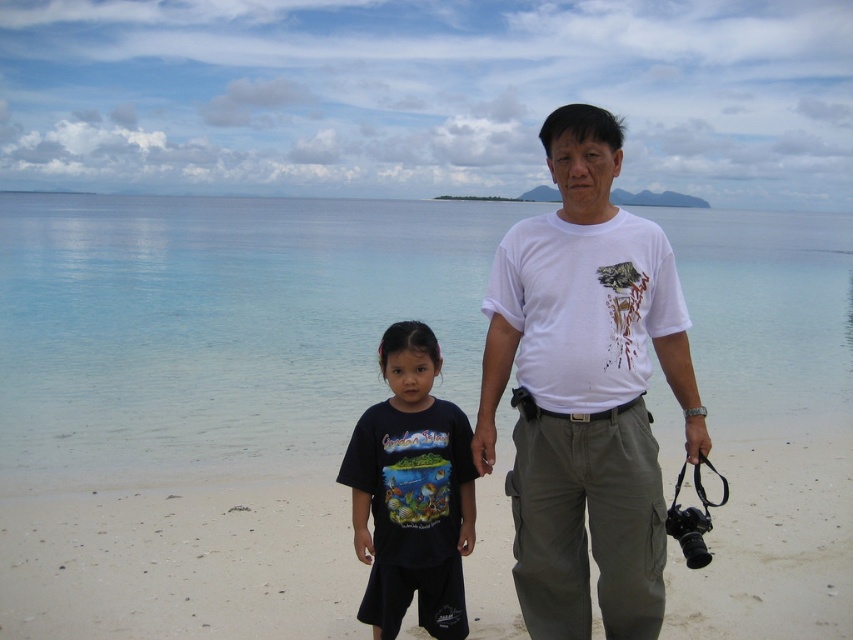
Question: Which object appears closest to the camera in this image?

Choices:
 (A) clear blue water at center
 (B) black cotton shirt at center
 (C) beige sand at lower center

Answer: (A)

Question: Which point is farther to the camera?

Choices:
 (A) clear blue water at center
 (B) black cotton shirt at center
 (C) white cotton t-shirt at center
 (D) beige sand at lower center

Answer: (D)

Question: Which of the following is the farthest from the observer?

Choices:
 (A) (428, 609)
 (B) (482, 372)

Answer: (A)

Question: Is clear blue water at center smaller than black cotton shirt at center?

Choices:
 (A) no
 (B) yes

Answer: (A)

Question: Can you confirm if beige sand at lower center is positioned to the left of white cotton t-shirt at center?

Choices:
 (A) no
 (B) yes

Answer: (B)

Question: Can you confirm if white cotton t-shirt at center is bigger than black cotton shirt at center?

Choices:
 (A) yes
 (B) no

Answer: (B)